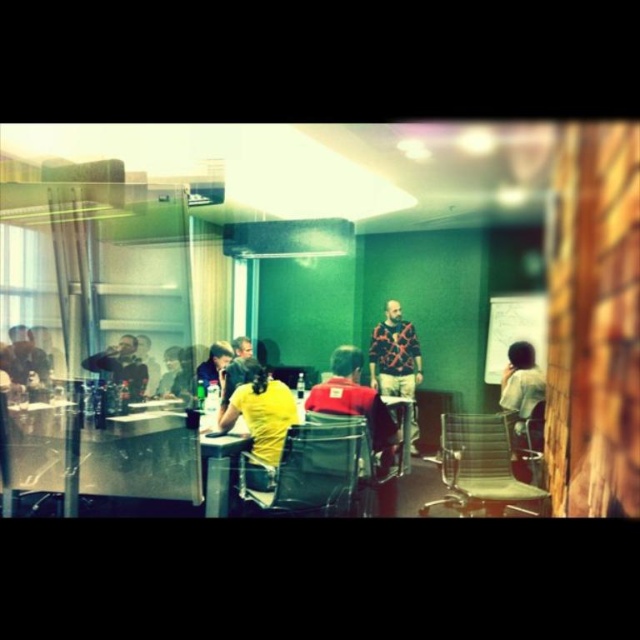
Is leather-like chair at lower right shorter than plaid shirt at center?

Yes, leather-like chair at lower right is shorter than plaid shirt at center.

Can you confirm if leather-like chair at lower right is wider than plaid shirt at center?

Yes, leather-like chair at lower right is wider than plaid shirt at center.

The height and width of the screenshot is (640, 640). What are the coordinates of `leather-like chair at lower right` in the screenshot? It's located at (483, 467).

This screenshot has height=640, width=640. Identify the location of leather-like chair at lower right. (483, 467).

Is point (193, 444) more distant than point (408, 445)?

No, (193, 444) is in front of (408, 445).

Which is in front, point (8, 472) or point (397, 472)?

Positioned in front is point (8, 472).

Image resolution: width=640 pixels, height=640 pixels. What are the coordinates of `transparent glass table at left` in the screenshot? It's located at (100, 456).

From the picture: Is transparent plastic chair at center wider than metallic mesh chair at lower left?

Correct, the width of transparent plastic chair at center exceeds that of metallic mesh chair at lower left.

Is point (272, 499) closer to viewer compared to point (3, 422)?

No, (272, 499) is behind (3, 422).

Does point (284, 451) come in front of point (8, 492)?

No, it is behind (8, 492).

I want to click on transparent plastic chair at center, so click(310, 468).